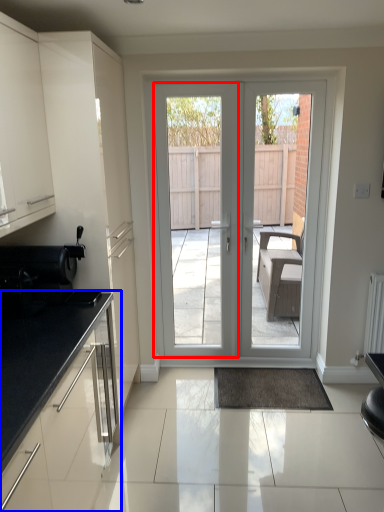
Question: Among these objects, which one is nearest to the camera, screen door (highlighted by a red box) or cabinetry (highlighted by a blue box)?

Choices:
 (A) screen door
 (B) cabinetry

Answer: (B)